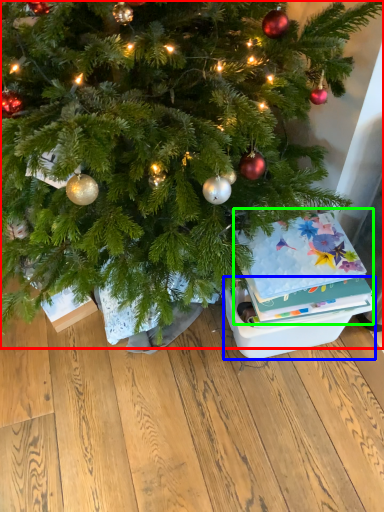
Question: Considering the real-world distances, which object is farthest from christmas tree (highlighted by a red box)? storage box (highlighted by a blue box) or christmas card (highlighted by a green box)?

Choices:
 (A) storage box
 (B) christmas card

Answer: (A)